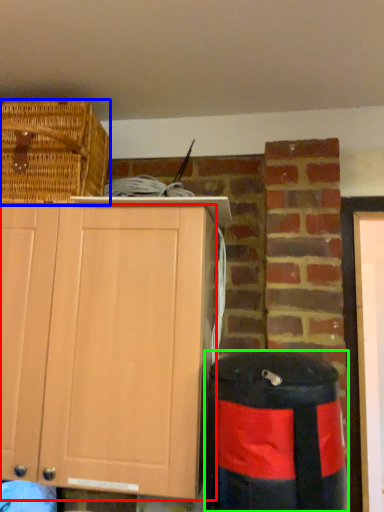
Question: Which is farther away from cabinetry (highlighted by a red box)? picnic basket (highlighted by a blue box) or trash bin/can (highlighted by a green box)?

Choices:
 (A) picnic basket
 (B) trash bin/can

Answer: (A)